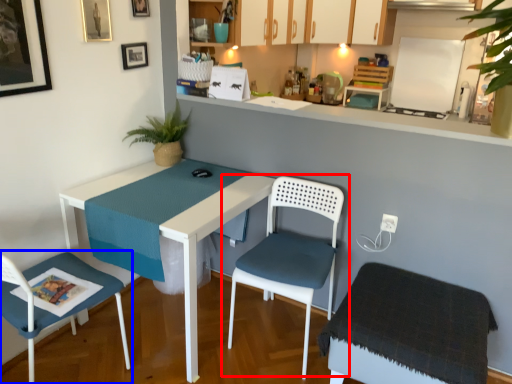
Question: Among these objects, which one is farthest to the camera, chair (highlighted by a red box) or chair (highlighted by a blue box)?

Choices:
 (A) chair
 (B) chair

Answer: (A)